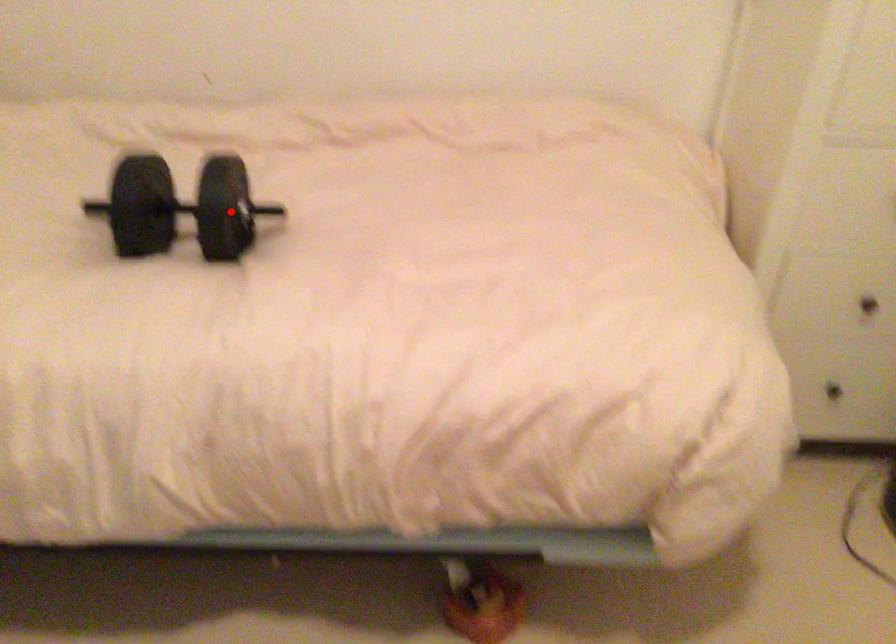
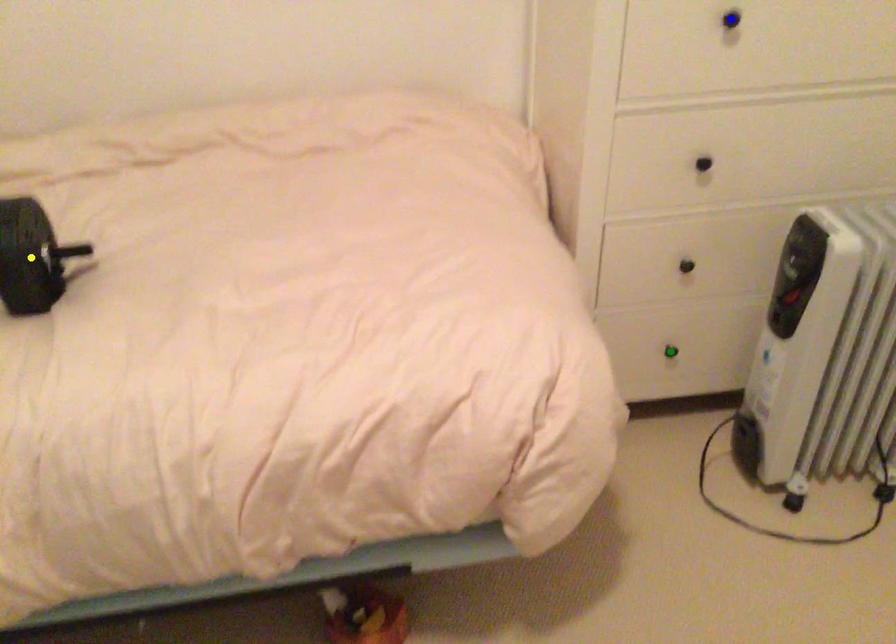
Question: I am providing you with two images of the same scene from different viewpoints. A red point is marked on the first image. You are given multiple points on the second image. Which point in image 2 is actually the same real-world point as the red point in image 1?

Choices:
 (A) blue point
 (B) green point
 (C) yellow point

Answer: (C)